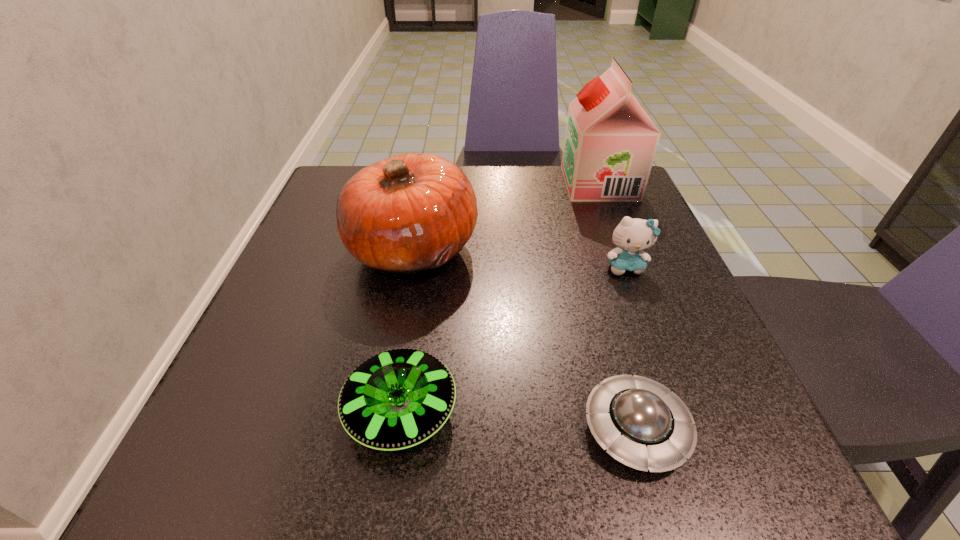
Find the location of a particular element. vacant space located 0.090m with the cap open on the soya milk is located at coordinates (529, 184).

I want to click on vacant space located on the front of the pumpkin, so point(368,500).

The height and width of the screenshot is (540, 960). I want to click on blank space located 0.090m on the face of the kitten, so click(643, 314).

You are a GUI agent. You are given a task and a screenshot of the screen. Output one action in this format:
    pyautogui.click(x=<x>, y=<y>)
    Task: Click on the free spot located on the right of the left saucer
    The image size is (960, 540).
    Given the screenshot: What is the action you would take?
    pyautogui.click(x=507, y=411)

You are a GUI agent. You are given a task and a screenshot of the screen. Output one action in this format:
    pyautogui.click(x=<x>, y=<y>)
    Task: Click on the vacant space located on the left of the right saucer
    The image size is (960, 540).
    Given the screenshot: What is the action you would take?
    (x=480, y=429)

Find the location of a particular element. soya milk that is at the far edge is located at coordinates (610, 143).

Find the location of a particular element. pumpkin at the far edge is located at coordinates (406, 214).

The width and height of the screenshot is (960, 540). In order to click on object at the left edge in this screenshot , I will do `click(406, 214)`.

Identify the location of soya milk located in the right edge section of the desktop. (610, 143).

What are the coordinates of `kitten that is at the right edge` in the screenshot? It's located at (632, 236).